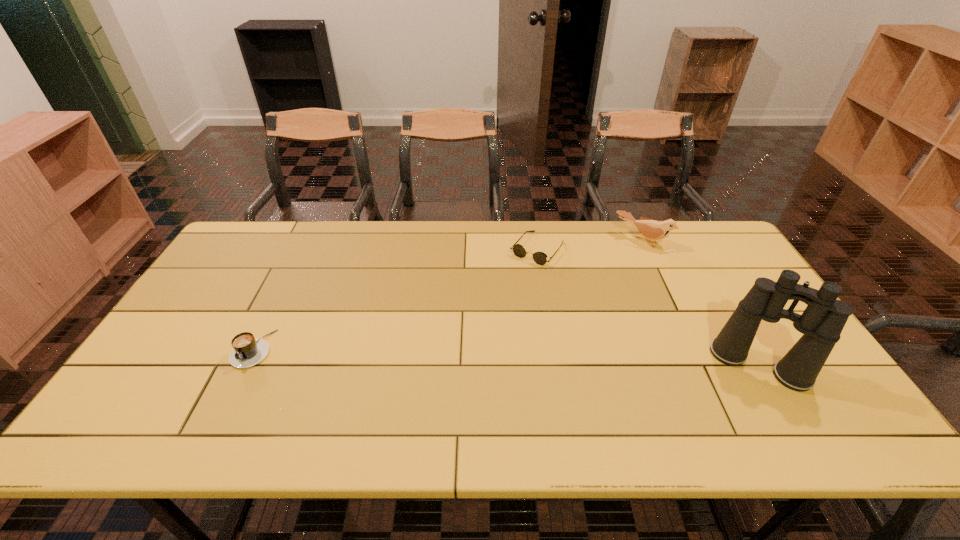
The width and height of the screenshot is (960, 540). Identify the location of vacant area located 0.100m at the beak of the second tallest object. (620, 267).

Identify the location of free spot located at the beak of the second tallest object. Image resolution: width=960 pixels, height=540 pixels. (589, 309).

In order to click on sunglasses located in the far edge section of the desktop in this screenshot , I will do `click(540, 258)`.

In order to click on bird that is at the far edge in this screenshot , I will do `click(654, 230)`.

Locate an element on the screen. The height and width of the screenshot is (540, 960). object present at the near edge is located at coordinates (821, 323).

The image size is (960, 540). Identify the location of object present at the right edge. (821, 323).

Where is `object that is at the near right corner`? object that is at the near right corner is located at coordinates (821, 323).

I want to click on free space at the far edge, so click(405, 221).

Locate an element on the screen. This screenshot has width=960, height=540. free location at the near edge is located at coordinates (629, 381).

Identify the location of vacant space at the left edge of the desktop. This screenshot has height=540, width=960. (216, 267).